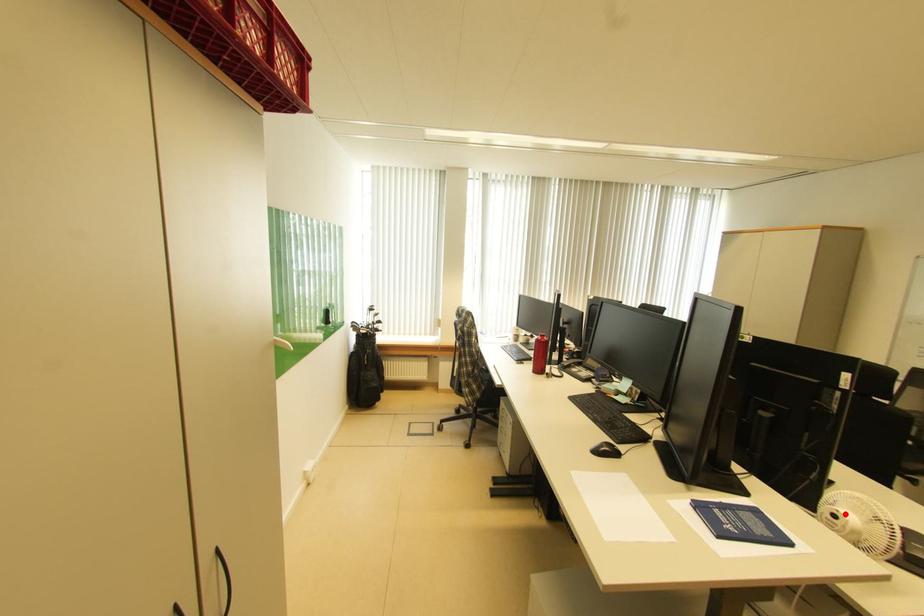
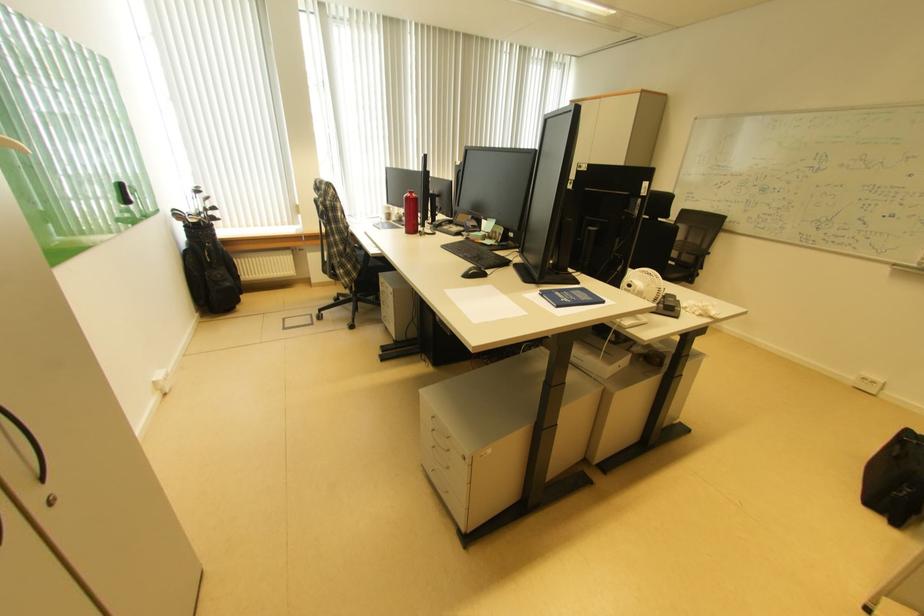
Locate, in the second image, the point that corresponds to the highlighted location in the first image.

(639, 284)